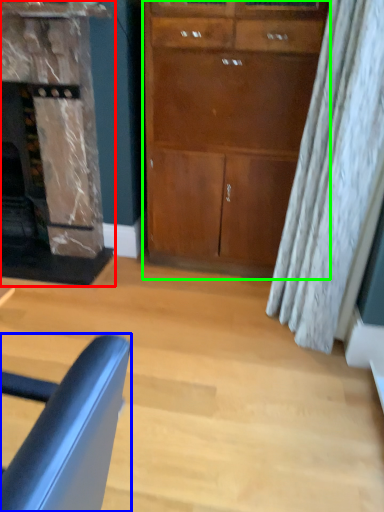
Question: Which object is the farthest from fireplace (highlighted by a red box)? Choose among these: chair (highlighted by a blue box) or cabinetry (highlighted by a green box).

Choices:
 (A) chair
 (B) cabinetry

Answer: (A)